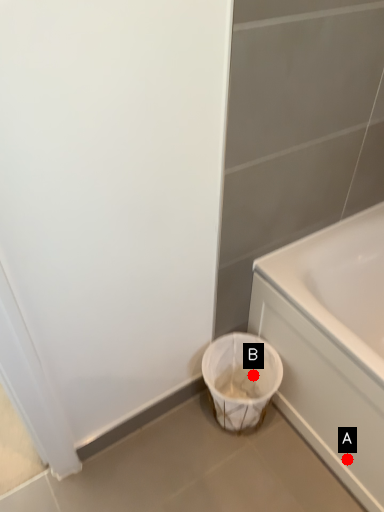
Question: Two points are circled on the image, labeled by A and B beside each circle. Which point is closer to the camera?

Choices:
 (A) A is closer
 (B) B is closer

Answer: (A)